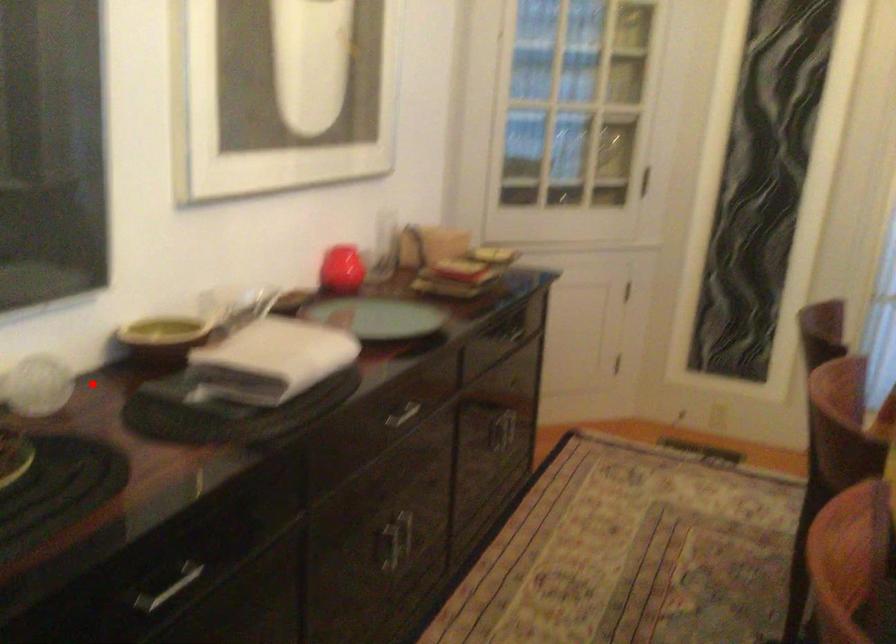
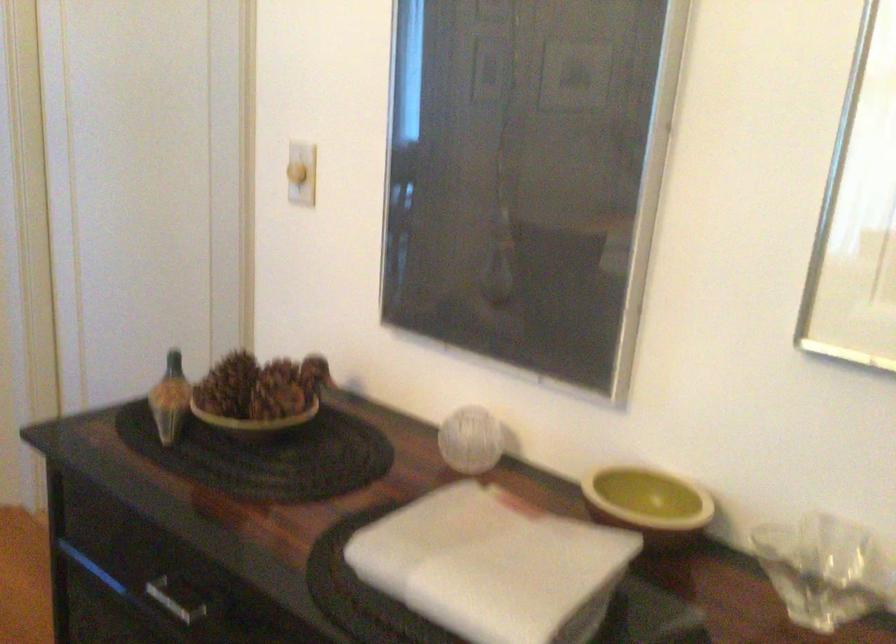
Question: I am providing you with two images of the same scene from different viewpoints. Given a red point in image1, look at the same physical point in image2. Is it:

Choices:
 (A) Closer to the viewpoint
 (B) Farther from the viewpoint

Answer: (A)